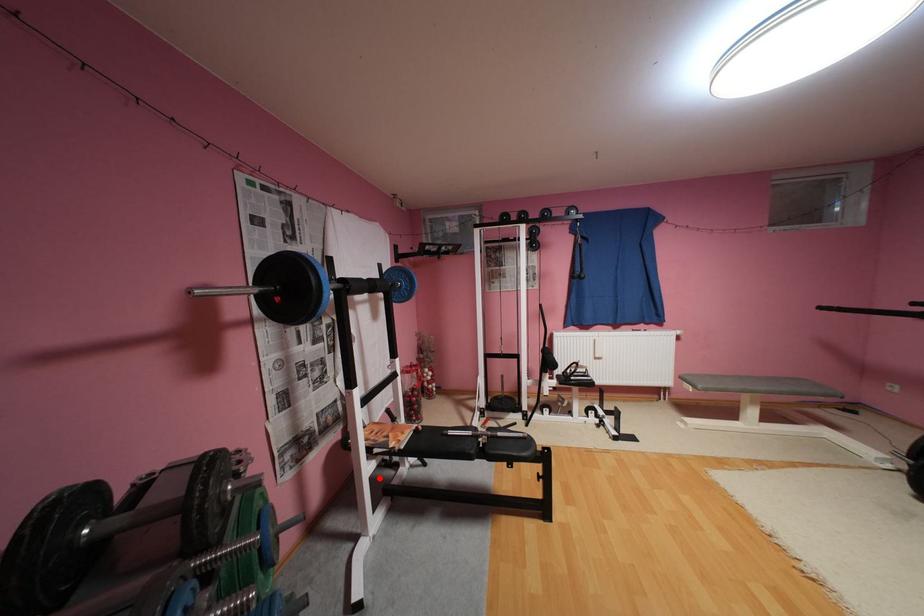
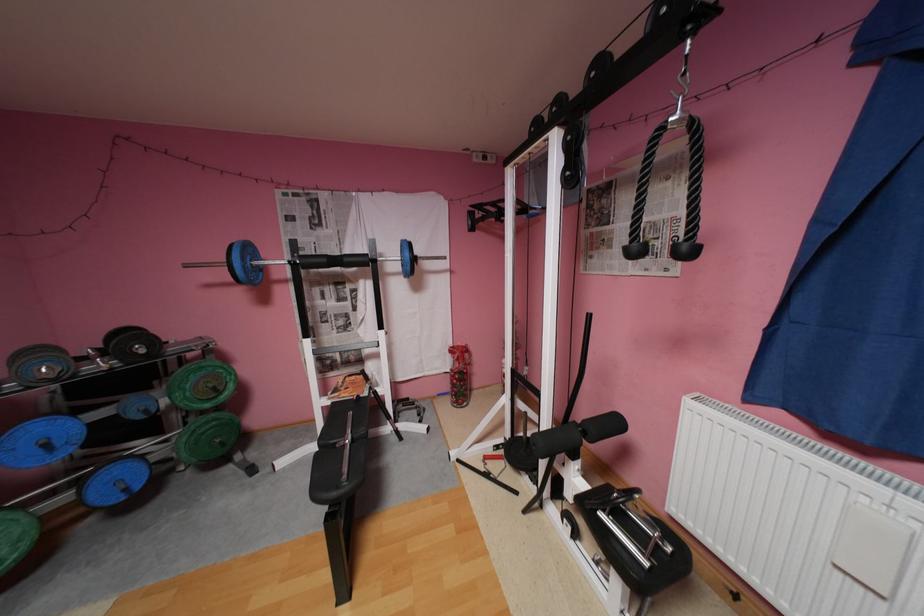
The point at the highlighted location is marked in the first image. Where is the corresponding point in the second image?

(333, 408)